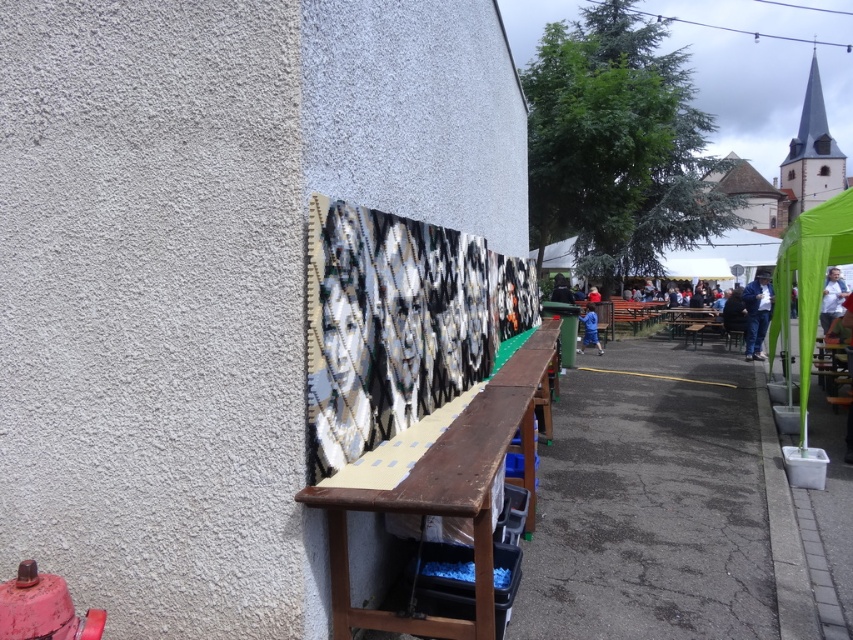
You are standing at the entrance of the market and want to take a photo of both point (831,300) and point (577,348) in the scene. Since you can only focus on one point at a time, which point should you focus on to ensure both points are in focus?

You should focus on point (577,348) because it is farther from the camera than point (831,300). By focusing on the farther point, the depth of field will include the closer point as well, ensuring both are in focus.

From the picture: You are at an outdoor event and see the green fabric canopy at right and the white fabric at right. Which one is positioned more to the left?

The green fabric canopy at right is positioned more to the left than the white fabric at right.

You are setting up a photo shoot and need to know which object is shorter between the black and white woven tapestry at center and the green fabric canopy at right. Can you tell me?

The black and white woven tapestry at center is not as tall as the green fabric canopy at right, so the tapestry is shorter.